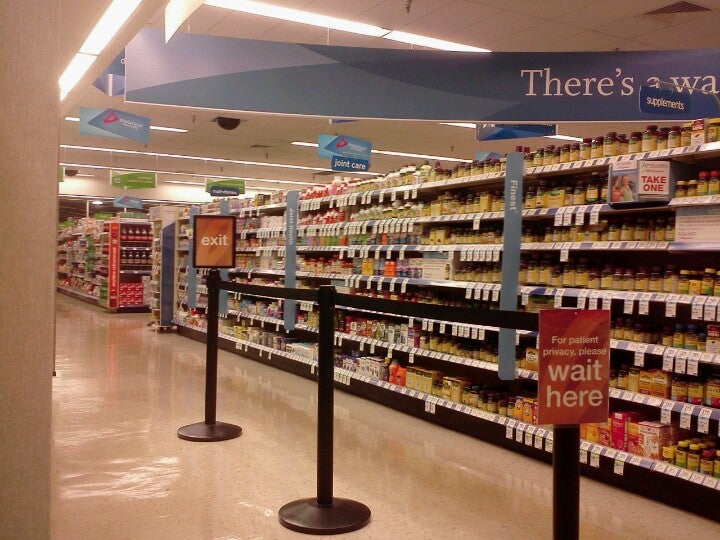
Locate an element on the screen. walls is located at coordinates (186, 201), (99, 187).